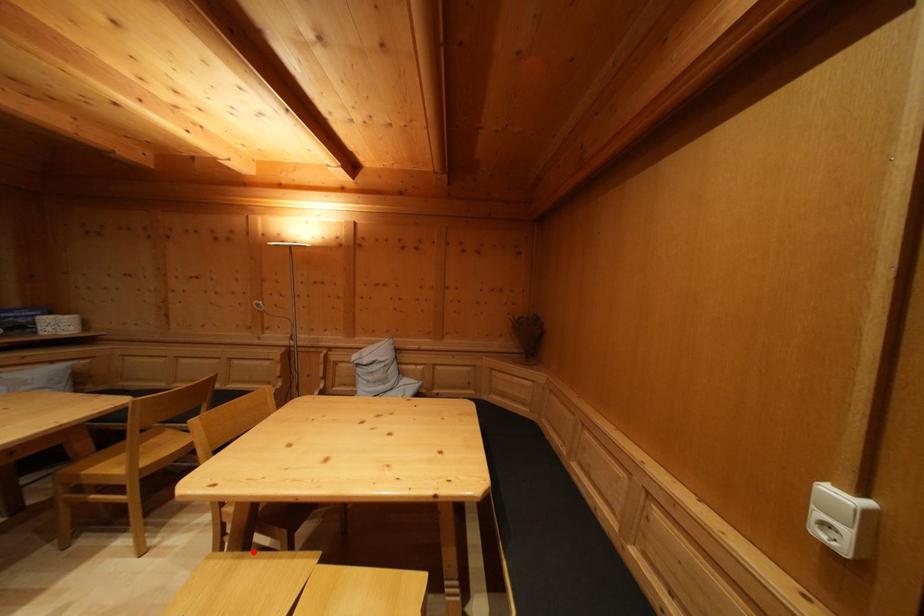
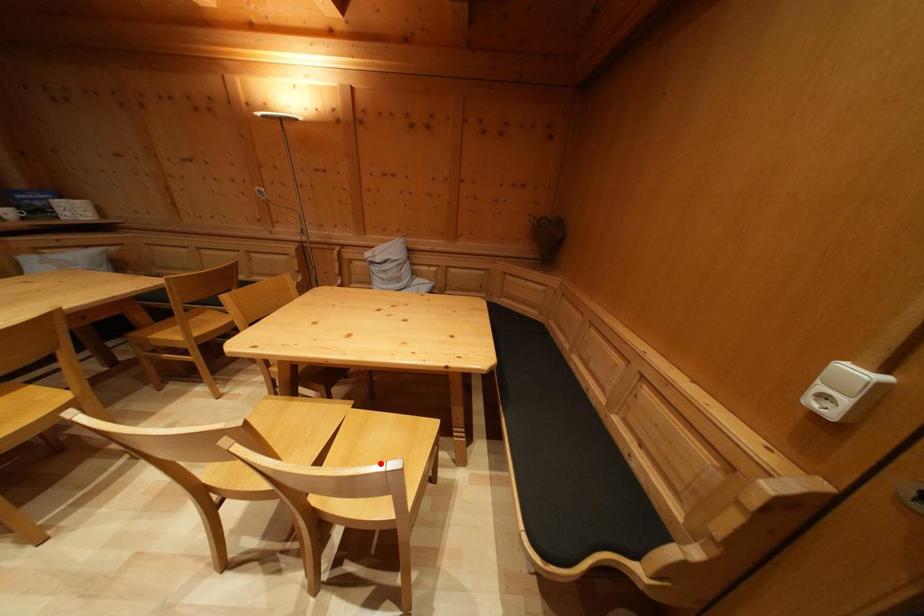
I am providing you with two images of the same scene from different viewpoints. A red point is marked on the first image and another point is marked on the second image. Is the marked point in image1 the same physical position as the marked point in image2?

No